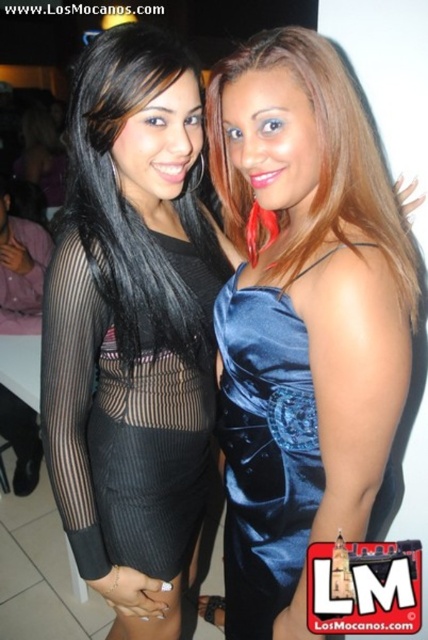
You are a photographer holding a camera and want to capture a closeup shot of the satin blue dress at upper right. Given that the minimum focusing distance of your camera is 30 inches, can you take the photo without moving closer?

The satin blue dress at upper right and camera are 31.55 inches apart from each other. Since the minimum focusing distance is 30 inches, you can take the photo without moving closer because the distance is sufficient.

You are at a party and want to take a photo with both the satin blue dress at upper right and the black mesh dress at center. Which dress is located to the right of the other?

The satin blue dress at upper right is positioned on the right side of black mesh dress at center.